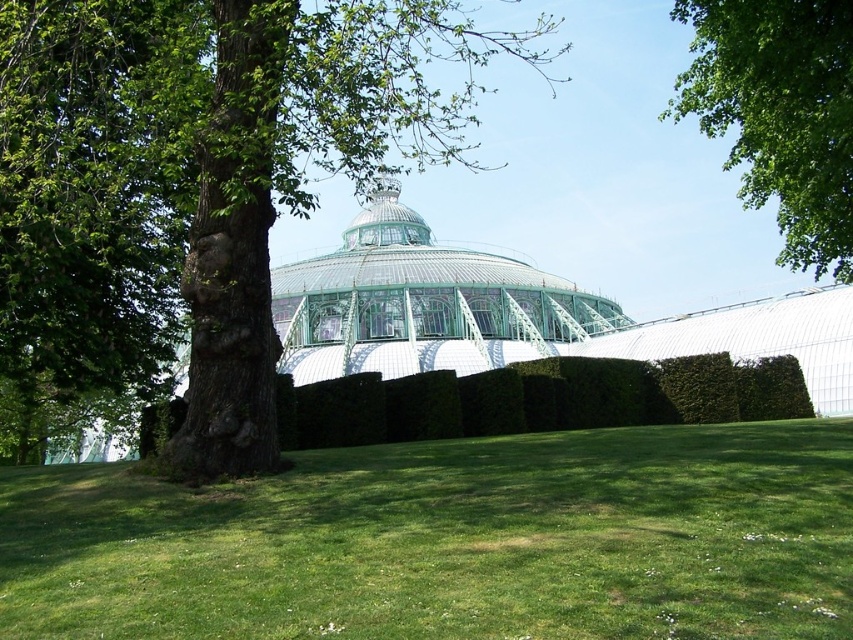
You are a bird looking for a nesting spot. You see the green rough bark tree at left and the green leafy tree at upper right. Which tree would be taller for nesting?

The green rough bark tree at left is taller than the green leafy tree at upper right, so it would be a better option for nesting.

You are planning to place a large sculpture between the green rough bark tree at left and the green glass dome at center. Based on their widths, which object should you consider for positioning the sculpture closer to?

The green rough bark tree at left might be wider than the green glass dome at center, so positioning the sculpture closer to the green rough bark tree at left would provide more space.

You are standing in front of the greenhouse and want to take a photo of the green rough bark tree at left. If your camera can focus on objects up to 40 meters away, will it be able to capture the tree clearly?

The green rough bark tree at left is 39.66 meters from camera, so yes, the camera can focus on it clearly since it is within the 40 meters range.